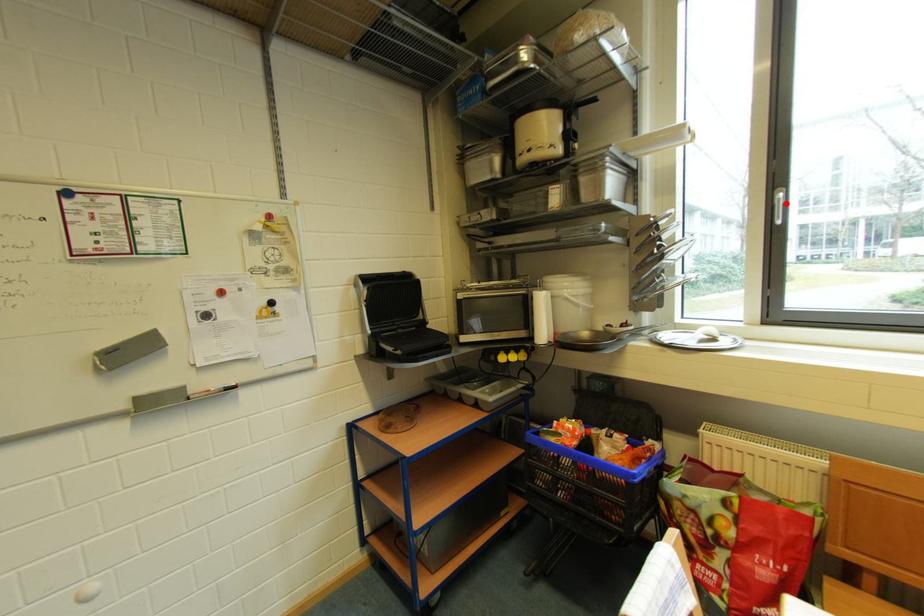
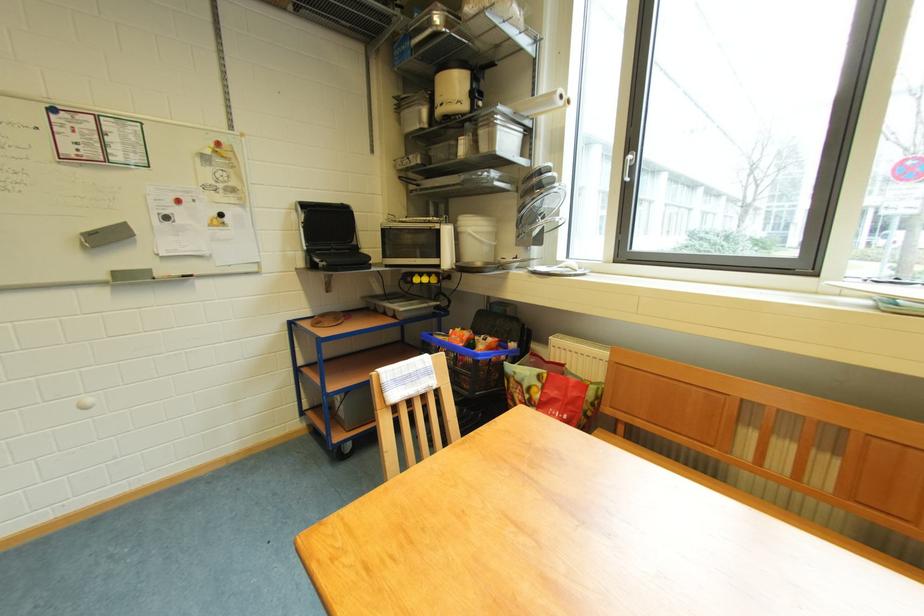
Where in the second image is the point corresponding to the highlighted location from the first image?

(634, 161)